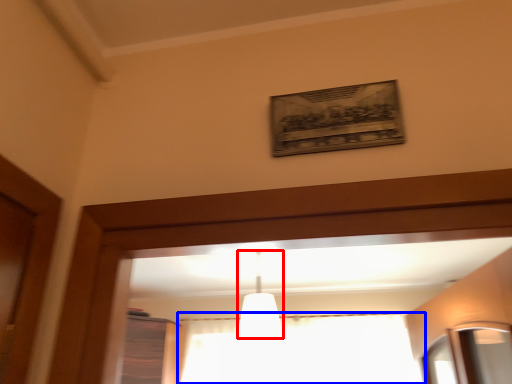
Question: Which object is closer to the camera taking this photo, fixture (highlighted by a red box) or curtain (highlighted by a blue box)?

Choices:
 (A) fixture
 (B) curtain

Answer: (A)